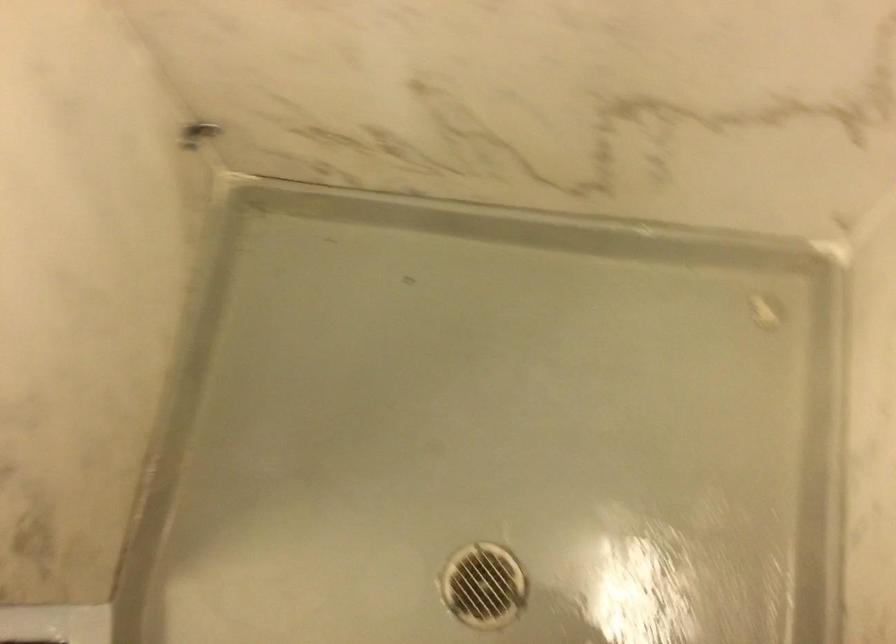
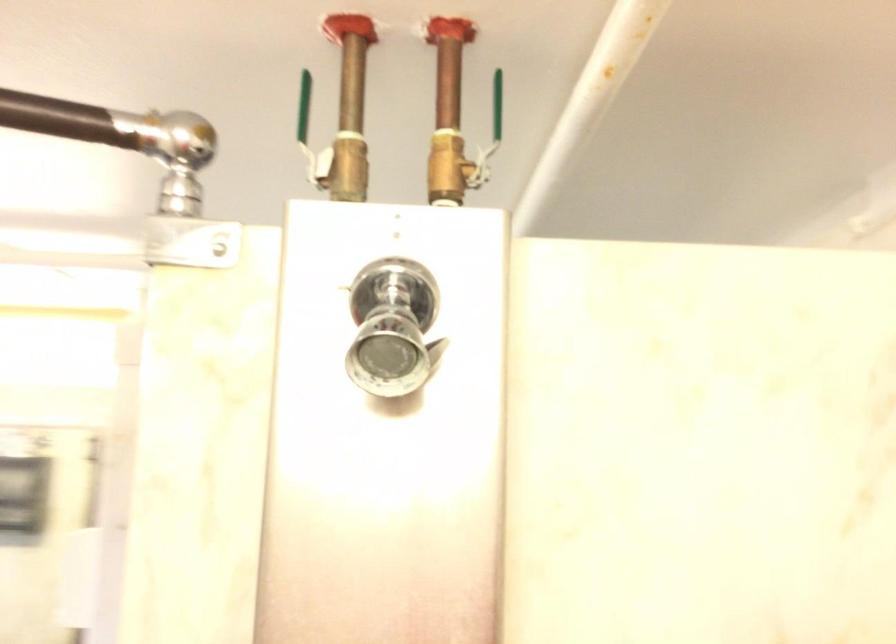
Question: Based on the continuous images, in which direction is the camera rotating? Reply with the corresponding letter.

Choices:
 (A) Left
 (B) Right
 (C) Up
 (D) Down

Answer: (A)